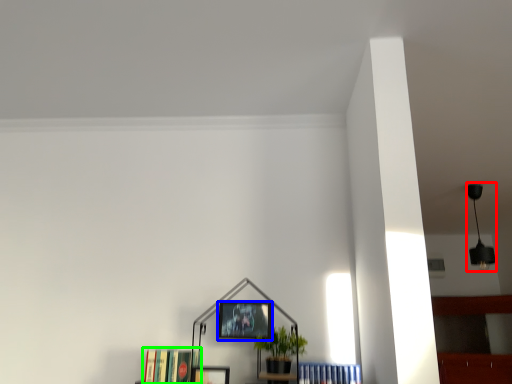
Question: Considering the real-world distances, which object is closest to lamp (highlighted by a red box)? picture frame (highlighted by a blue box) or book (highlighted by a green box).

Choices:
 (A) picture frame
 (B) book

Answer: (A)